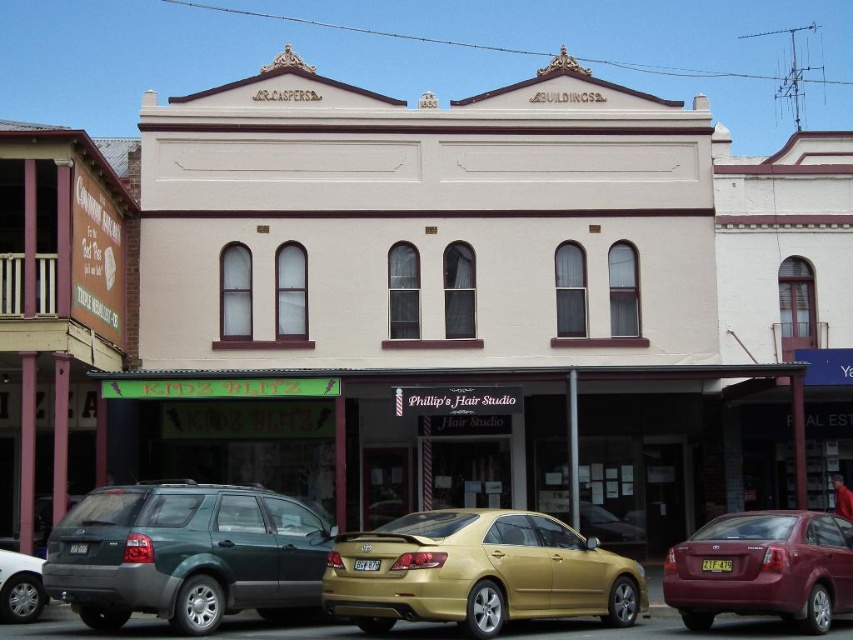
Question: Which point appears farthest from the camera in this image?

Choices:
 (A) (71, 532)
 (B) (570, 520)
 (C) (41, 564)
 (D) (786, 561)

Answer: (B)

Question: Can you confirm if silver metallic sedan at lower left is thinner than metallic gold sedan at center?

Choices:
 (A) no
 (B) yes

Answer: (B)

Question: Which of the following is the closest to the observer?

Choices:
 (A) gold metallic sedan at center
 (B) green matte suv at lower left
 (C) maroon metallic sedan at lower right
 (D) metallic gold sedan at center

Answer: (A)

Question: Estimate the real-world distances between objects in this image. Which object is farther from the gold metallic sedan at center?

Choices:
 (A) maroon metallic sedan at lower right
 (B) silver metallic sedan at lower left

Answer: (B)

Question: From the image, what is the correct spatial relationship of green matte suv at lower left in relation to metallic gold sedan at center?

Choices:
 (A) right
 (B) left

Answer: (B)

Question: Is the position of green matte suv at lower left less distant than that of metallic gold sedan at center?

Choices:
 (A) yes
 (B) no

Answer: (A)